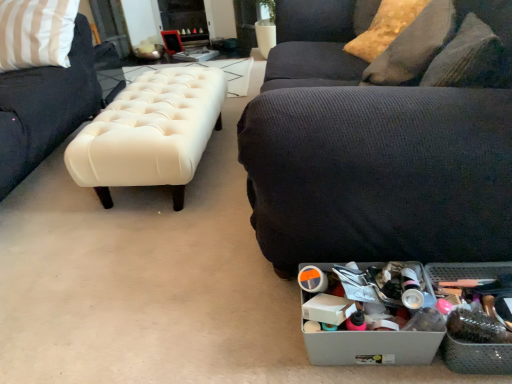
Question: From a real-world perspective, relative to shiny gold pillow at upper right, the second pillow ordered from the bottom, is metallic gray storage box at lower right, which is the second storage box in right-to-left order, vertically above or below?

Choices:
 (A) below
 (B) above

Answer: (A)

Question: Considering the positions of metallic gray storage box at lower right, which is the second storage box in right-to-left order, and shiny gold pillow at upper right, the second pillow ordered from the bottom, in the image, is metallic gray storage box at lower right, which is the second storage box in right-to-left order, wider or thinner than shiny gold pillow at upper right, the second pillow ordered from the bottom,?

Choices:
 (A) wide
 (B) thin

Answer: (B)

Question: Which object is positioned closest to the shiny gold pillow at upper right, the second pillow ordered from the bottom?

Choices:
 (A) dark gray textured couch at lower right
 (B) textured yellow pillow at upper right, which appears as the 2th pillow when viewed from the top
 (C) metallic gray storage box at lower right, which is the second storage box in right-to-left order
 (D) creamy leather bench at center
 (E) metallic gray storage box at lower right, which is the 2th storage box from left to right

Answer: (B)

Question: Which is nearer to the textured yellow pillow at upper right, which appears as the 2th pillow when viewed from the top?

Choices:
 (A) shiny gold pillow at upper right, which is the first pillow from top to bottom
 (B) metallic gray storage box at lower right, which is counted as the first storage box, starting from the left
 (C) dark gray textured couch at lower right
 (D) metallic gray storage box at lower right, which is the 2th storage box from left to right
 (E) creamy leather bench at center

Answer: (C)